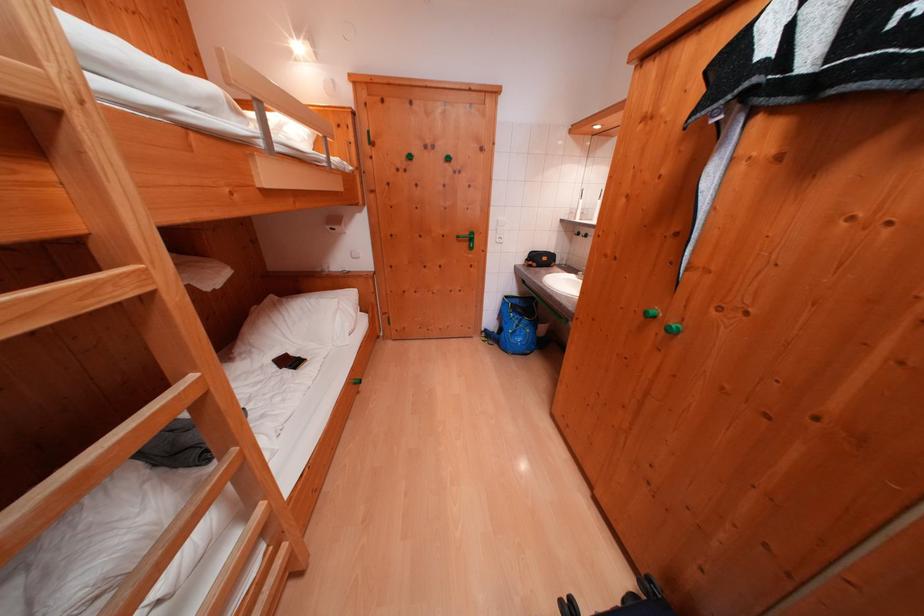
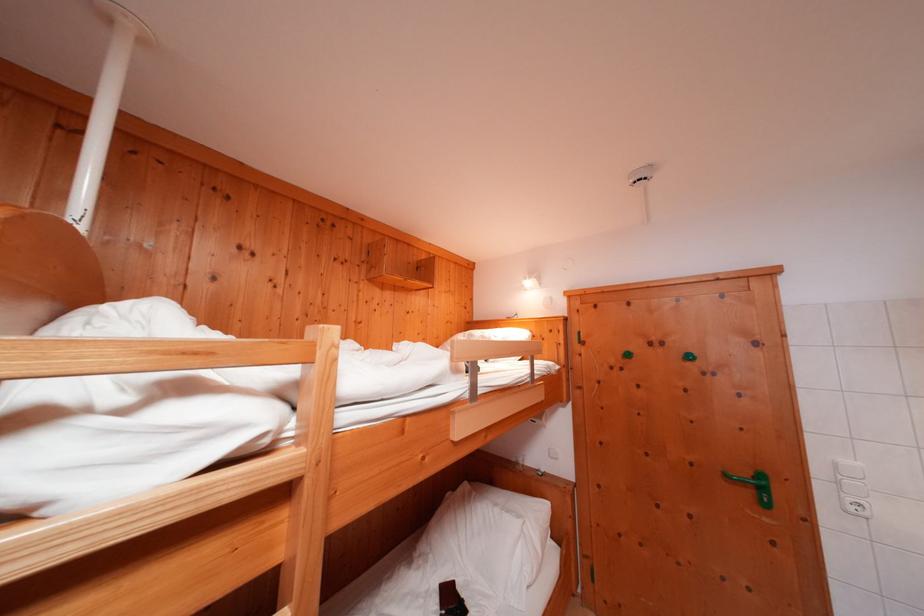
Locate, in the second image, the point that corresponds to [358,277] in the first image.

(552, 477)